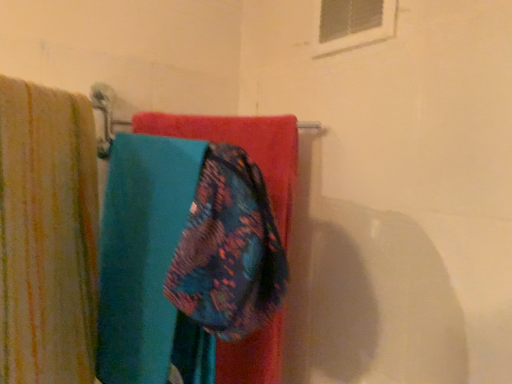
What do you see at coordinates (47, 235) in the screenshot?
I see `striped cotton towel at left` at bounding box center [47, 235].

What is the approximate height of floral fabric towel at center?

It is 9.01 inches.

Identify the location of white plastic window at upper center. Image resolution: width=512 pixels, height=384 pixels. (353, 24).

Which is behind, point (45, 246) or point (54, 234)?

Positioned behind is point (54, 234).

Could you tell me if striped cotton towel at left is turned towards teal fabric towel at center?

Yes.

Is striped cotton towel at left not inside teal fabric towel at center?

Yes, striped cotton towel at left is outside of teal fabric towel at center.

Can you see floral fabric towel at center touching white plastic window at upper center?

There is a gap between floral fabric towel at center and white plastic window at upper center.

Is floral fabric towel at center further to the viewer compared to white plastic window at upper center?

No, it is not.

Could you tell me if floral fabric towel at center is turned towards white plastic window at upper center?

No.

Does floral fabric towel at center appear on the left side of white plastic window at upper center?

Yes.

In the scene shown: How many degrees apart are the facing directions of white plastic window at upper center and teal fabric towel at center?

The angular difference between white plastic window at upper center and teal fabric towel at center is 92.9 degrees.

From a real-world perspective, is white plastic window at upper center over teal fabric towel at center?

Yes, from a real-world perspective, white plastic window at upper center is above teal fabric towel at center.

Which of these two, white plastic window at upper center or teal fabric towel at center, is smaller?

white plastic window at upper center is smaller.

Is white plastic window at upper center not close to teal fabric towel at center?

That's not correct — white plastic window at upper center is a little close to teal fabric towel at center.

From the image's perspective, is floral fabric towel at center located above or below teal fabric towel at center?

Based on their image positions, floral fabric towel at center is located above teal fabric towel at center.

Can you confirm if floral fabric towel at center is smaller than teal fabric towel at center?

Yes.

What's the angular difference between floral fabric towel at center and teal fabric towel at center's facing directions?

floral fabric towel at center and teal fabric towel at center are facing 12.1 degrees away from each other.

Considering the sizes of objects floral fabric towel at center and teal fabric towel at center in the image provided, who is thinner, floral fabric towel at center or teal fabric towel at center?

floral fabric towel at center.

Is teal fabric towel at center smaller than striped cotton towel at left?

Yes.

From a real-world perspective, who is located higher, teal fabric towel at center or striped cotton towel at left?

striped cotton towel at left.

Based on the photo, could you tell me if teal fabric towel at center is facing striped cotton towel at left?

No, teal fabric towel at center is not oriented towards striped cotton towel at left.

In the image, is teal fabric towel at center positioned in front of or behind striped cotton towel at left?

teal fabric towel at center is positioned farther from the viewer than striped cotton towel at left.

Is striped cotton towel at left completely or partially inside white plastic window at upper center?

No.

From the picture: From the image's perspective, which one is positioned lower, white plastic window at upper center or striped cotton towel at left?

striped cotton towel at left is shown below in the image.

Is white plastic window at upper center next to striped cotton towel at left and touching it?

white plastic window at upper center and striped cotton towel at left are clearly separated.

Considering the sizes of white plastic window at upper center and floral fabric towel at center in the image, is white plastic window at upper center taller or shorter than floral fabric towel at center?

In the image, white plastic window at upper center appears to be taller than floral fabric towel at center.

Between white plastic window at upper center and floral fabric towel at center, which one has smaller size?

With smaller size is white plastic window at upper center.

Could you tell me if white plastic window at upper center is turned towards floral fabric towel at center?

No, white plastic window at upper center is not turned towards floral fabric towel at center.

Find the location of a particular element. This screenshot has width=512, height=384. curtain that is above the teal fabric towel at center (from the image's perspective) is located at coordinates (47, 235).

I want to click on window lying on the right of floral fabric towel at center, so click(x=353, y=24).

Looking at the image, which one is located closer to teal fabric towel at center, white plastic window at upper center or striped cotton towel at left?

Among the two, striped cotton towel at left is located nearer to teal fabric towel at center.

From the image, which object appears to be farther from white plastic window at upper center, floral fabric towel at center or teal fabric towel at center?

teal fabric towel at center lies further to white plastic window at upper center than the other object.

Estimate the real-world distances between objects in this image. Which object is closer to floral fabric towel at center, teal fabric towel at center or white plastic window at upper center?

teal fabric towel at center is closer to floral fabric towel at center.

Looking at the image, which one is located closer to striped cotton towel at left, white plastic window at upper center or floral fabric towel at center?

Based on the image, floral fabric towel at center appears to be nearer to striped cotton towel at left.

Which object lies further to the anchor point floral fabric towel at center, striped cotton towel at left or white plastic window at upper center?

Among the two, white plastic window at upper center is located further to floral fabric towel at center.

Considering their positions, is striped cotton towel at left positioned closer to teal fabric towel at center than white plastic window at upper center?

striped cotton towel at left is positioned closer to the anchor teal fabric towel at center.

When comparing their distances from striped cotton towel at left, does teal fabric towel at center or floral fabric towel at center seem further?

floral fabric towel at center is positioned further to the anchor striped cotton towel at left.

Based on their spatial positions, is floral fabric towel at center or striped cotton towel at left closer to white plastic window at upper center?

floral fabric towel at center.

Identify the location of curtain that lies between white plastic window at upper center and teal fabric towel at center from top to bottom. (47, 235).

This screenshot has width=512, height=384. I want to click on towel between white plastic window at upper center and striped cotton towel at left in the vertical direction, so click(243, 148).

Find the location of a particular element. Image resolution: width=512 pixels, height=384 pixels. towel between white plastic window at upper center and teal fabric towel at center from top to bottom is located at coordinates (243, 148).

You are a GUI agent. You are given a task and a screenshot of the screen. Output one action in this format:
    pyautogui.click(x=<x>, y=<y>)
    Task: Click on the laundry located between striped cotton towel at left and floral fabric towel at center in the left-right direction
    Image resolution: width=512 pixels, height=384 pixels.
    Given the screenshot: What is the action you would take?
    pyautogui.click(x=47, y=235)